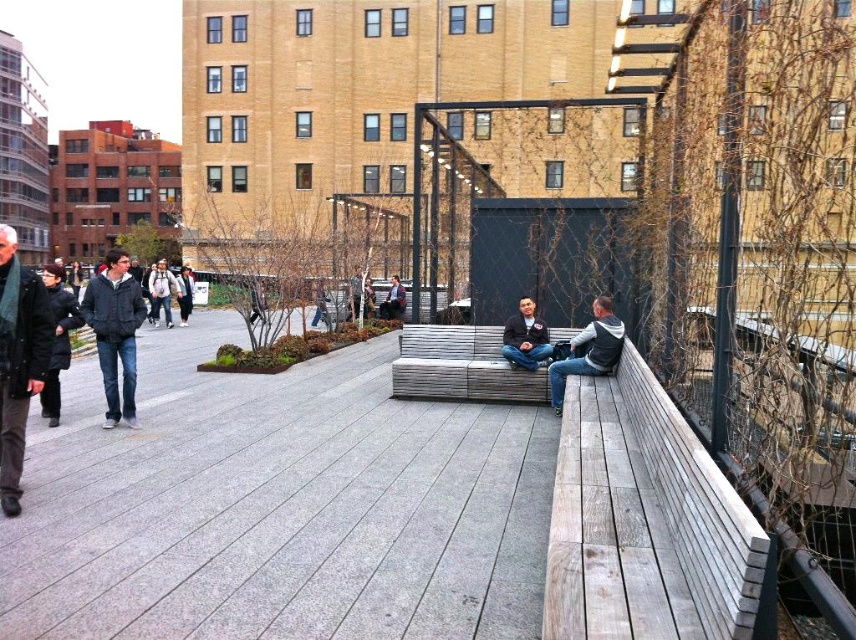
Question: Which point is closer to the camera?

Choices:
 (A) (3, 380)
 (B) (52, 387)
 (C) (152, 323)

Answer: (A)

Question: Does dark gray jacket at left lie in front of dark gray jacket at center?

Choices:
 (A) no
 (B) yes

Answer: (B)

Question: Observing the image, what is the correct spatial positioning of gray woven bench at center in reference to dark gray backpack at center?

Choices:
 (A) below
 (B) above

Answer: (A)

Question: Which point appears farthest from the camera in this image?

Choices:
 (A) (610, 305)
 (B) (510, 332)
 (C) (51, 413)

Answer: (B)

Question: Which is farther from the dark gray jacket at left?

Choices:
 (A) dark gray wool jacket at left
 (B) white cotton jacket at center
 (C) dark gray backpack at center

Answer: (C)

Question: Is dark gray wool jacket at left thinner than dark gray jacket at center?

Choices:
 (A) no
 (B) yes

Answer: (A)